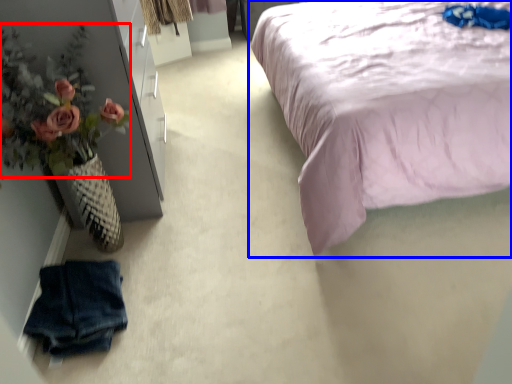
Question: Which point is closer to the camera, floral arrangement (highlighted by a red box) or bed (highlighted by a blue box)?

Choices:
 (A) floral arrangement
 (B) bed

Answer: (B)